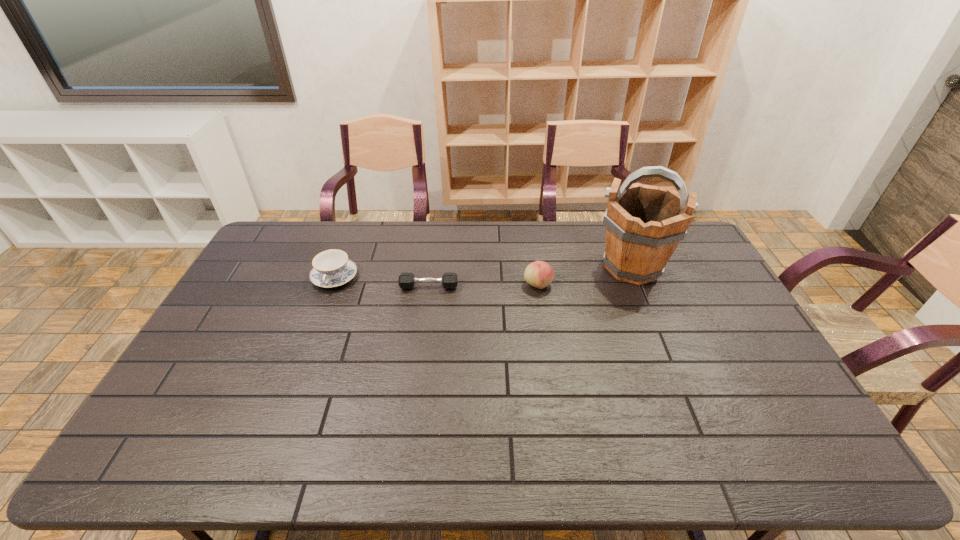
What are the coordinates of `free spot that satisfies the following two spatial constraints: 1. with the handle on the side of the leftmost object; 2. on the right side of the second object from left to right` in the screenshot? It's located at (331, 287).

I want to click on free location that satisfies the following two spatial constraints: 1. with the handle on the side of the peach; 2. on the left side of the chinaware, so (332, 285).